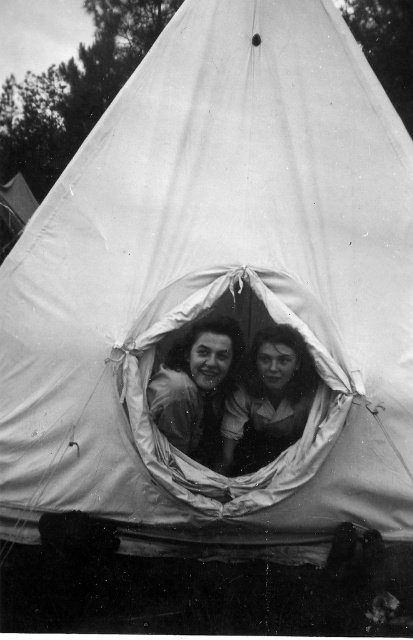
Question: Does smooth skin face at center have a lesser width compared to smooth fabric face at center?

Choices:
 (A) no
 (B) yes

Answer: (B)

Question: Which point is closer to the camera?

Choices:
 (A) smooth skin face at center
 (B) smooth fabric face at center

Answer: (A)

Question: Does smooth skin face at center lie in front of smooth fabric face at center?

Choices:
 (A) no
 (B) yes

Answer: (B)

Question: Is smooth skin face at center smaller than smooth fabric face at center?

Choices:
 (A) yes
 (B) no

Answer: (A)

Question: Among these objects, which one is nearest to the camera?

Choices:
 (A) smooth skin face at center
 (B) smooth fabric face at center

Answer: (A)